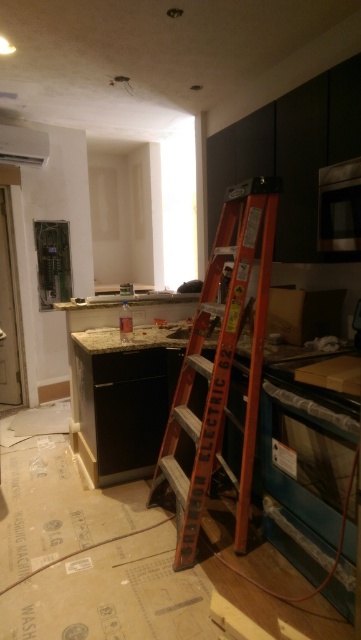
Question: Is orange wooden ladder at center to the right of white plastic exhaust hood at upper left from the viewer's perspective?

Choices:
 (A) no
 (B) yes

Answer: (B)

Question: Which of the following is the closest to the observer?

Choices:
 (A) (19, 157)
 (B) (233, 253)

Answer: (B)

Question: Which of the following is the closest to the observer?

Choices:
 (A) orange wooden ladder at center
 (B) white plastic exhaust hood at upper left

Answer: (A)

Question: Among these objects, which one is farthest from the camera?

Choices:
 (A) white plastic exhaust hood at upper left
 (B) orange wooden ladder at center

Answer: (A)

Question: Is orange wooden ladder at center above white plastic exhaust hood at upper left?

Choices:
 (A) yes
 (B) no

Answer: (B)

Question: Does orange wooden ladder at center appear under white plastic exhaust hood at upper left?

Choices:
 (A) no
 (B) yes

Answer: (B)